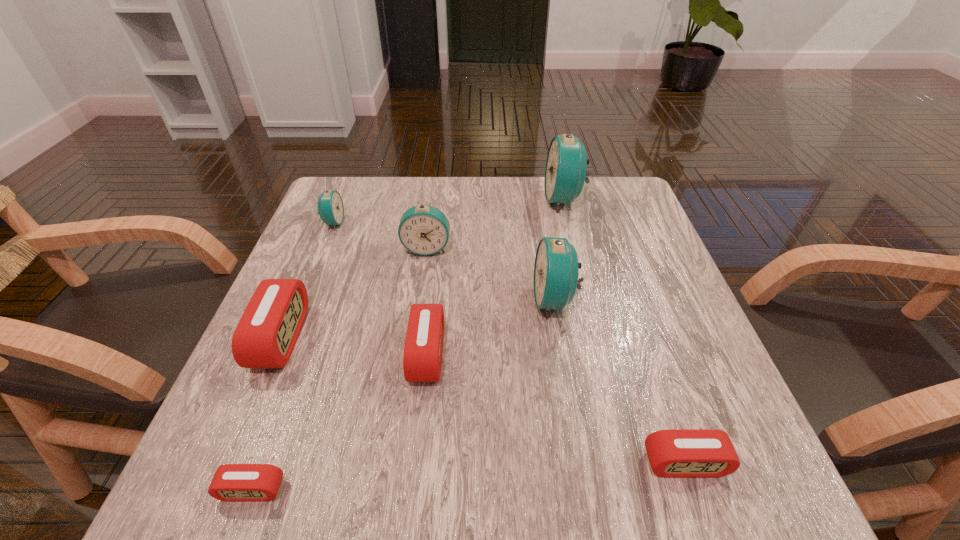
I want to click on free space located on the front-facing side of the third tallest object, so 413,352.

Where is `free region located on the front-facing side of the smallest blue alarm clock`? free region located on the front-facing side of the smallest blue alarm clock is located at coordinates (396, 223).

This screenshot has width=960, height=540. I want to click on vacant area situated 0.370m on the front-facing side of the biggest pink alarm clock, so click(x=498, y=337).

Find the location of a particular element. This screenshot has height=540, width=960. free space located 0.100m on the front-facing side of the second pink alarm clock from right to left is located at coordinates (498, 354).

Find the location of a particular element. object that is at the far left corner is located at coordinates (330, 209).

Identify the location of object that is positioned at the near left corner. (232, 482).

Image resolution: width=960 pixels, height=540 pixels. I want to click on object positioned at the far right corner, so click(565, 172).

Locate an element on the screen. object that is at the near right corner is located at coordinates (676, 453).

This screenshot has height=540, width=960. I want to click on free space at the far edge, so click(x=572, y=204).

Where is `free space at the near edge`? The image size is (960, 540). free space at the near edge is located at coordinates (543, 501).